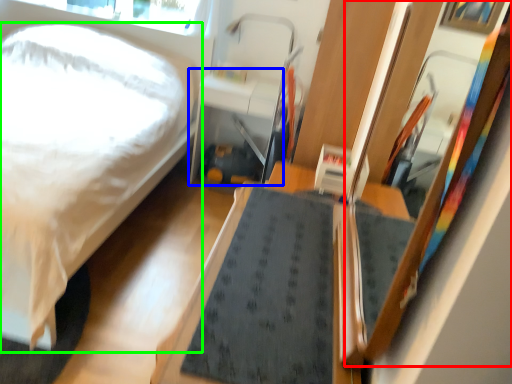
Question: Estimate the real-world distances between objects in this image. Which object is farther from mirror (highlighted by a red box), table (highlighted by a blue box) or bed (highlighted by a green box)?

Choices:
 (A) table
 (B) bed

Answer: (A)